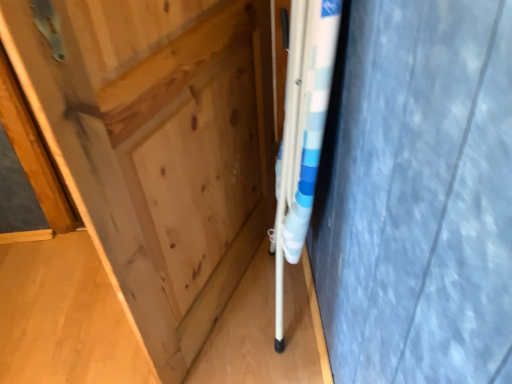
At what (x,y) coordinates should I click in order to perform the action: click on free space underneath white plastic crutch at center (from a real-world perspective). Please return your answer as a coordinate pair (x, y). Looking at the image, I should click on click(298, 302).